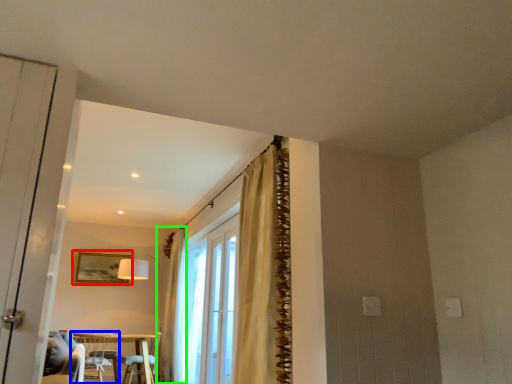
Question: Which is farther away from picture frame (highlighted by a red box)? chair (highlighted by a blue box) or curtain (highlighted by a green box)?

Choices:
 (A) chair
 (B) curtain

Answer: (B)